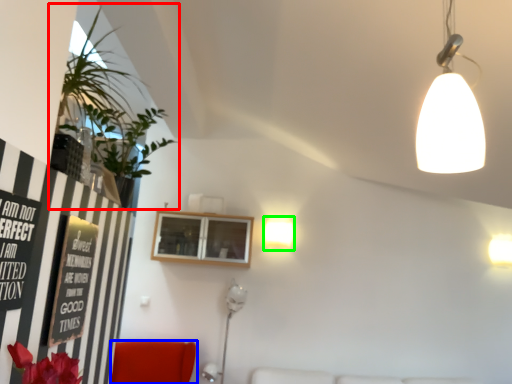
Question: Which is farther away from houseplant (highlighted by a red box)? furniture (highlighted by a blue box) or lamp (highlighted by a green box)?

Choices:
 (A) furniture
 (B) lamp

Answer: (B)